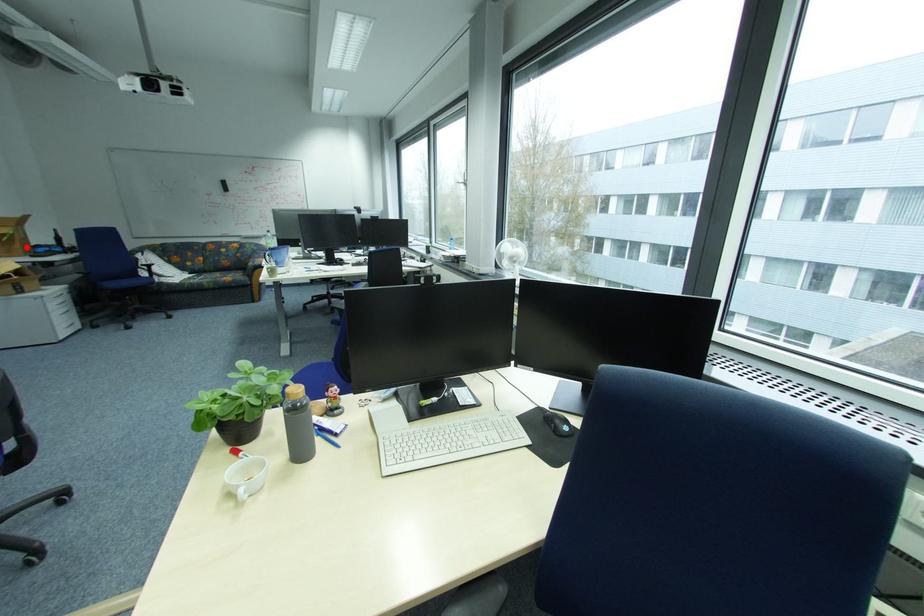
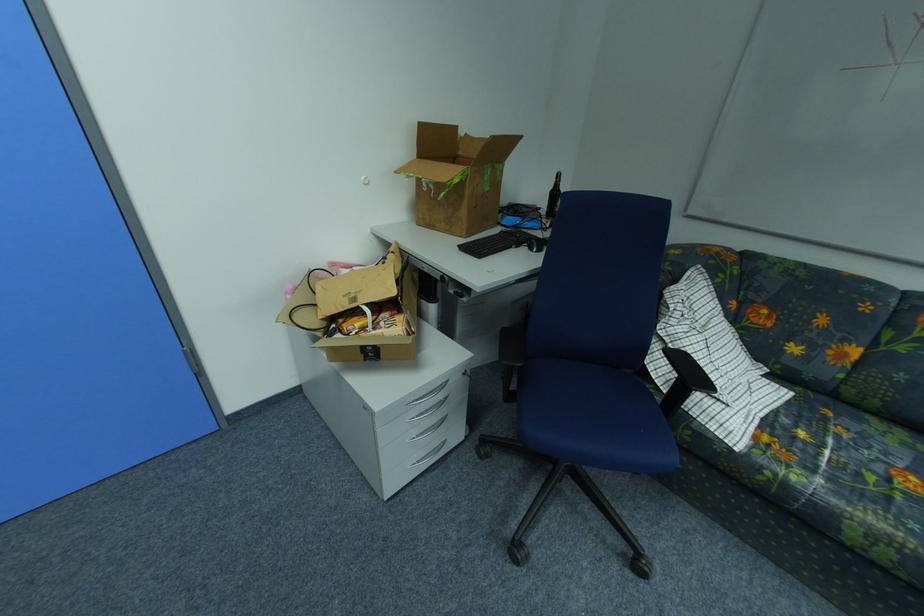
Question: I am providing you with two images of the same scene from different viewpoints. A red point is shown in image1. For the corresponding object point in image2, is it positioned nearer or farther from the camera?

Choices:
 (A) Nearer
 (B) Farther

Answer: (A)